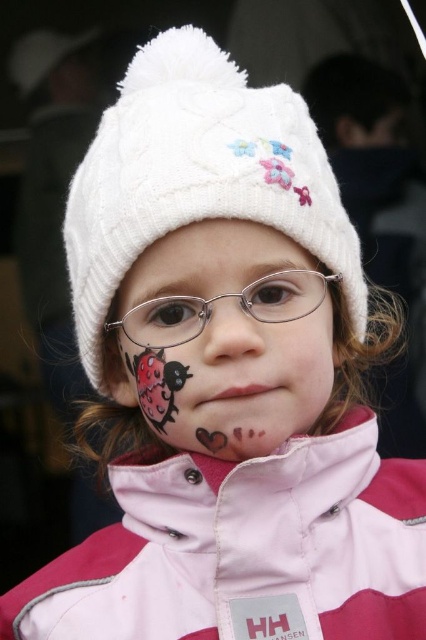
Is point (348, 621) positioned before point (238, 292)?

No.

Does pink softshell jacket at center have a larger size compared to matte plastic nose at center?

Yes, pink softshell jacket at center is bigger than matte plastic nose at center.

Locate an element on the screen. This screenshot has height=640, width=426. pink softshell jacket at center is located at coordinates (244, 548).

The image size is (426, 640). In order to click on pink softshell jacket at center in this screenshot , I will do `click(244, 548)`.

Who is lower down, pink softshell jacket at center or matte pink face at center?

Positioned lower is pink softshell jacket at center.

Describe the element at coordinates (244, 548) in the screenshot. The height and width of the screenshot is (640, 426). I see `pink softshell jacket at center` at that location.

Where is `pink softshell jacket at center`? This screenshot has width=426, height=640. pink softshell jacket at center is located at coordinates (244, 548).

From the picture: Between matte pink face at center and matte plastic nose at center, which one has more height?

With more height is matte pink face at center.

At what (x,y) coordinates should I click in order to perform the action: click on matte pink face at center. Please return your answer as a coordinate pair (x, y). The image size is (426, 640). Looking at the image, I should click on (226, 342).